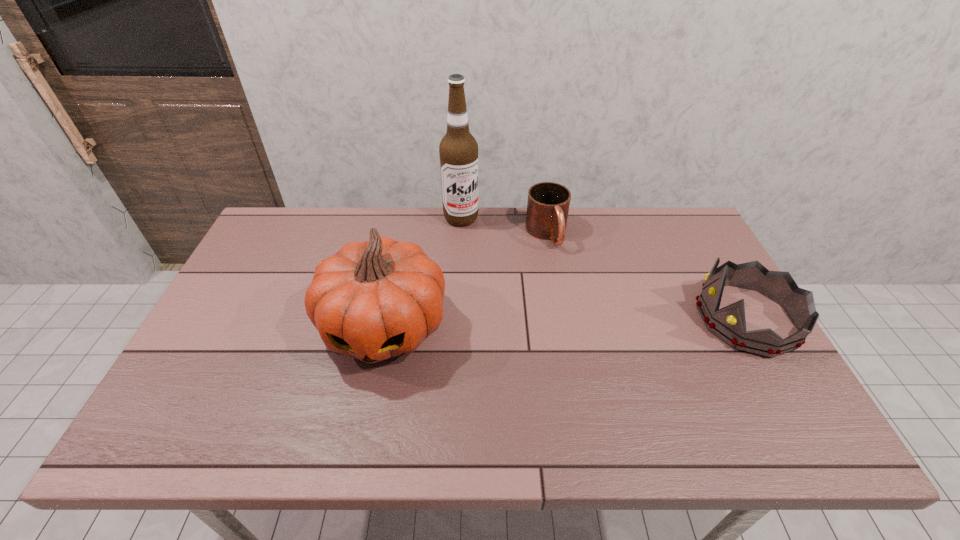
Where is `vacant space that satisfies the following two spatial constraints: 1. on the front side of the second object from right to left; 2. at the front of the rightmost object with jewels`? vacant space that satisfies the following two spatial constraints: 1. on the front side of the second object from right to left; 2. at the front of the rightmost object with jewels is located at coordinates (562, 319).

Locate an element on the screen. The image size is (960, 540). vacant point that satisfies the following two spatial constraints: 1. on the front side of the rightmost object; 2. at the front of the alcohol with jewels is located at coordinates (456, 319).